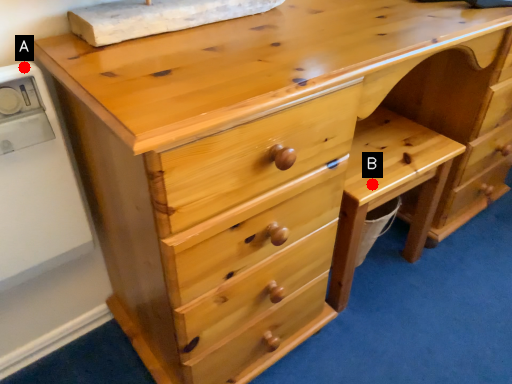
Question: Two points are circled on the image, labeled by A and B beside each circle. Among these points, which one is nearest to the camera?

Choices:
 (A) A is closer
 (B) B is closer

Answer: (A)